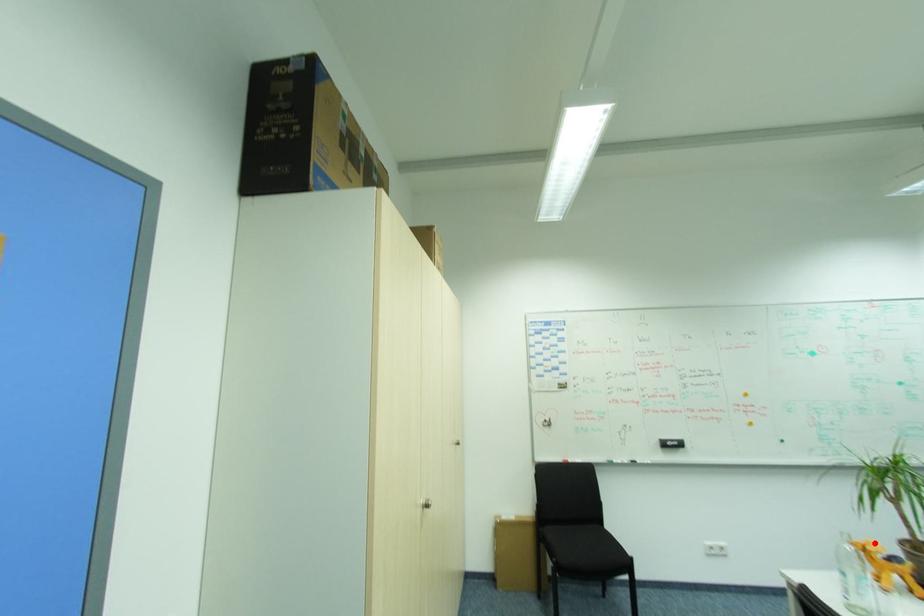
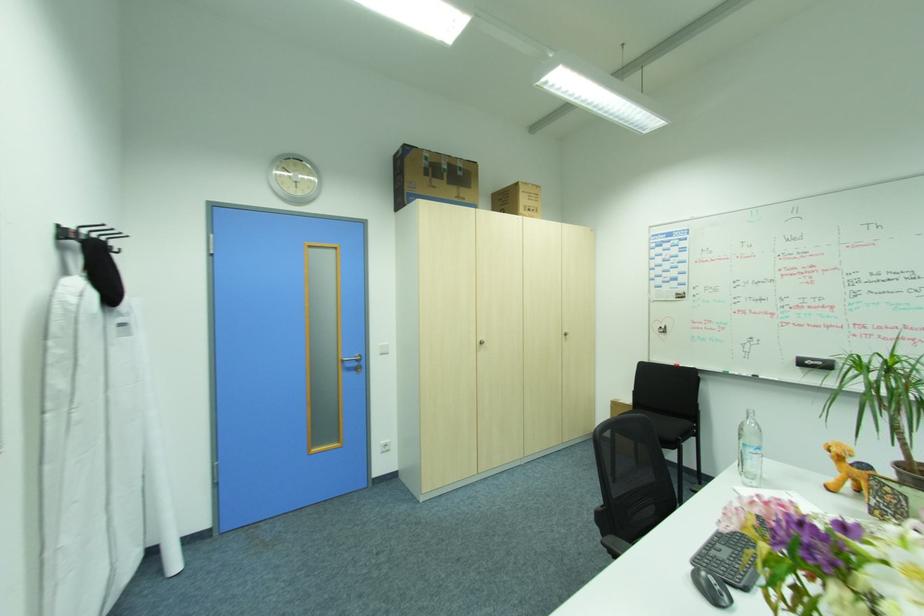
Question: I am providing you with two images of the same scene from different viewpoints. In image1, a red point is highlighted. Considering the same 3D point in image2, which of the following is correct?

Choices:
 (A) It is closer
 (B) It is farther

Answer: (B)